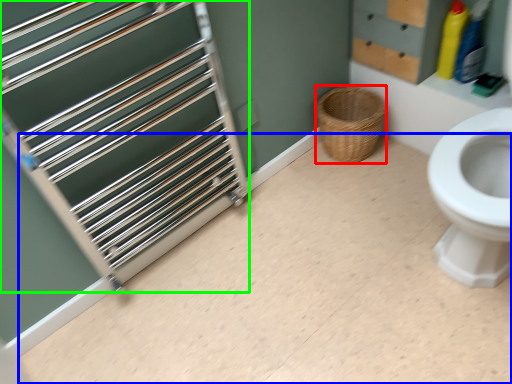
Question: Considering the real-world distances, which object is farthest from basket (highlighted by a red box)? plain (highlighted by a blue box) or cage (highlighted by a green box)?

Choices:
 (A) plain
 (B) cage

Answer: (B)